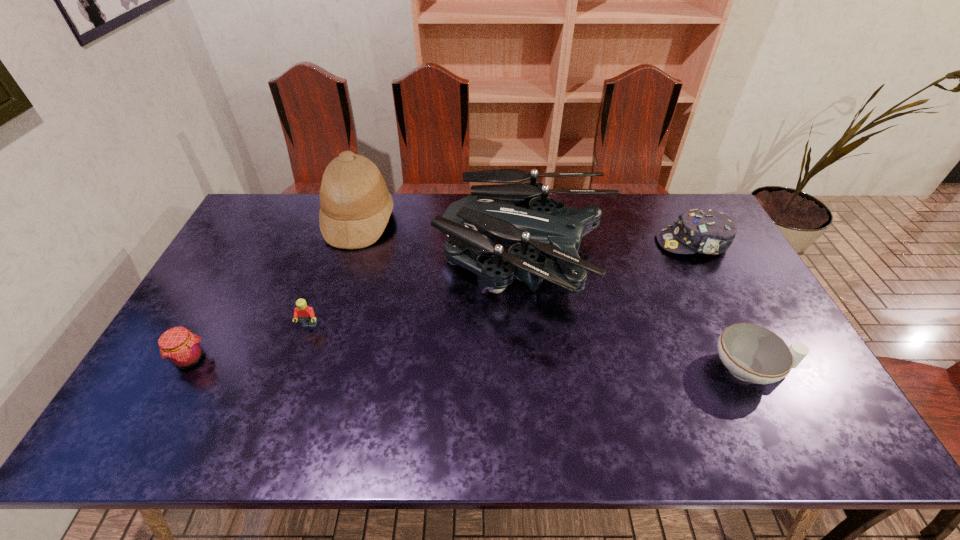
Locate an element on the screen. The image size is (960, 540). free spot located 0.200m on the front-facing side of the headwear is located at coordinates (597, 242).

The image size is (960, 540). I want to click on vacant space located 0.240m on the front-facing side of the headwear, so click(x=585, y=242).

Where is `vacant space located on the face of the Lego`? This screenshot has width=960, height=540. vacant space located on the face of the Lego is located at coordinates (295, 368).

Locate an element on the screen. blank space located on the right of the leftmost object is located at coordinates (283, 359).

Locate an element on the screen. The height and width of the screenshot is (540, 960). hat that is at the far edge is located at coordinates (356, 205).

Identify the location of drone present at the far edge. Image resolution: width=960 pixels, height=540 pixels. (521, 215).

The image size is (960, 540). What are the coordinates of `headwear that is at the far edge` in the screenshot? It's located at (705, 231).

Identify the location of object that is at the left edge. (182, 349).

This screenshot has width=960, height=540. Identify the location of headwear located at the right edge. (705, 231).

In order to click on chinaware positioned at the right edge in this screenshot , I will do `click(752, 353)`.